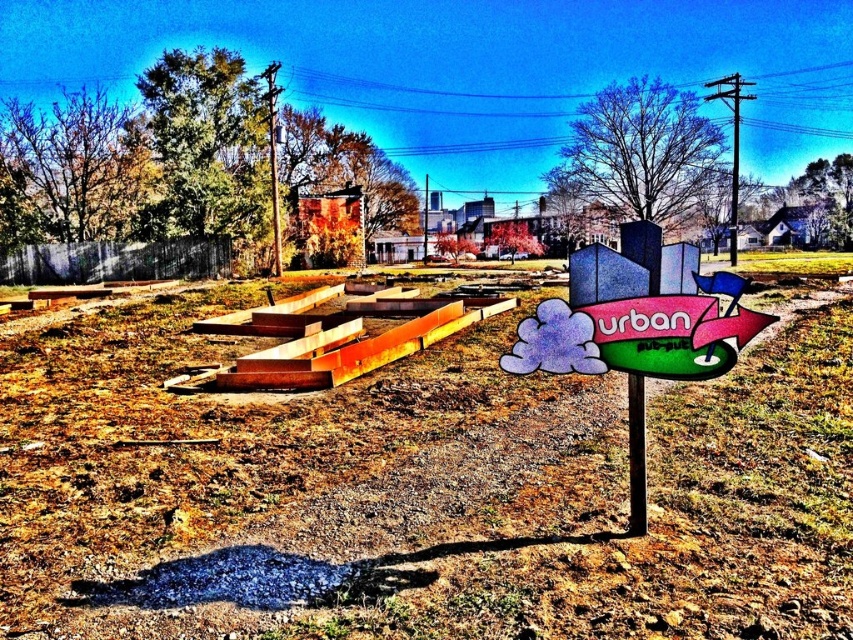
You are a construction worker who needs to secure a safety net between the metallic pole at upper center and the metallic pole at center. Which pole should you attach the top of the safety net to?

The metallic pole at upper center is much taller than the metallic pole at center, so you should attach the top of the safety net to the metallic pole at upper center to ensure proper coverage.

You are a construction worker standing at the edge of the construction site. You need to secure a safety net between the metallic pole at upper right and the metallic pole at center. Which pole is positioned higher to ensure the net can be properly anchored?

The metallic pole at upper right is above the metallic pole at center, so it is positioned higher and should be used to anchor the safety net properly.

Consider the image. You are a construction worker who needs to secure a safety net between the metallic pole at upper right and the metallic pole at center. Which pole should you attach the top of the safety net to?

You should attach the top of the safety net to the metallic pole at upper right because it is much taller than the metallic pole at center.